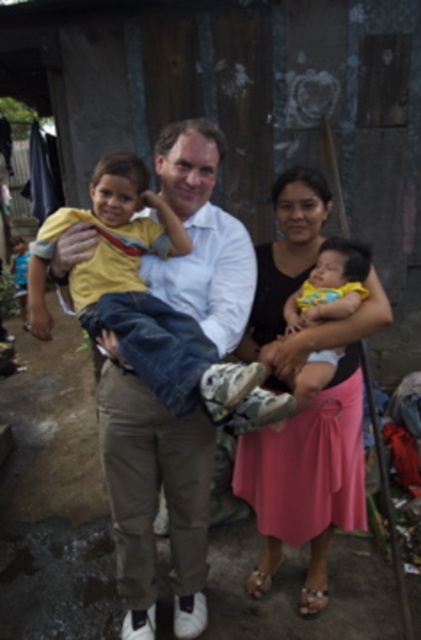
Question: Which object is closer to the camera taking this photo?

Choices:
 (A) khaki pants at center
 (B) yellow matte shirt at center
 (C) matte yellow shirt at center

Answer: (B)

Question: Is khaki pants at center thinner than yellow fabric baby at center?

Choices:
 (A) no
 (B) yes

Answer: (A)

Question: Which point appears farthest from the camera in this image?

Choices:
 (A) (282, 477)
 (B) (44, 262)
 (C) (332, 352)

Answer: (A)

Question: Can you confirm if pink fabric skirt at lower right is positioned above yellow matte shirt at center?

Choices:
 (A) no
 (B) yes

Answer: (A)

Question: Can you confirm if khaki pants at center is wider than matte yellow shirt at center?

Choices:
 (A) no
 (B) yes

Answer: (A)

Question: Which is nearer to the yellow matte shirt at center?

Choices:
 (A) matte yellow shirt at center
 (B) pink fabric skirt at lower right

Answer: (A)